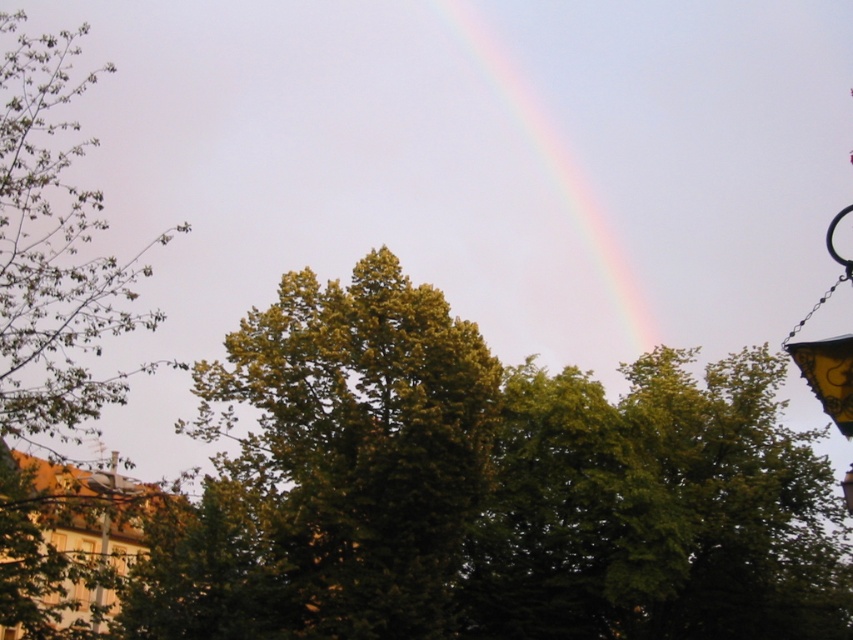
Where is `green leafy tree at center`? The width and height of the screenshot is (853, 640). green leafy tree at center is located at coordinates (486, 490).

Is green leafy tree at center taller than metallic pole at lower left?

Correct, green leafy tree at center is much taller as metallic pole at lower left.

Is point (727, 508) closer to camera compared to point (103, 548)?

No.

The image size is (853, 640). In order to click on green leafy tree at center in this screenshot , I will do `click(486, 490)`.

Can you confirm if rainbow at upper center is positioned to the right of metallic pole at lower left?

Correct, you'll find rainbow at upper center to the right of metallic pole at lower left.

Does rainbow at upper center have a lesser height compared to metallic pole at lower left?

No.

This screenshot has width=853, height=640. What do you see at coordinates (556, 179) in the screenshot? I see `rainbow at upper center` at bounding box center [556, 179].

This screenshot has width=853, height=640. In order to click on rainbow at upper center in this screenshot , I will do `click(556, 179)`.

Between point (636, 410) and point (552, 129), which one is positioned behind?

Positioned behind is point (552, 129).

Does green leafy tree at center appear under rainbow at upper center?

Indeed, green leafy tree at center is positioned under rainbow at upper center.

Between point (753, 371) and point (581, 214), which one is positioned in front?

Point (753, 371) is more forward.

Locate an element on the screen. green leafy tree at center is located at coordinates (486, 490).